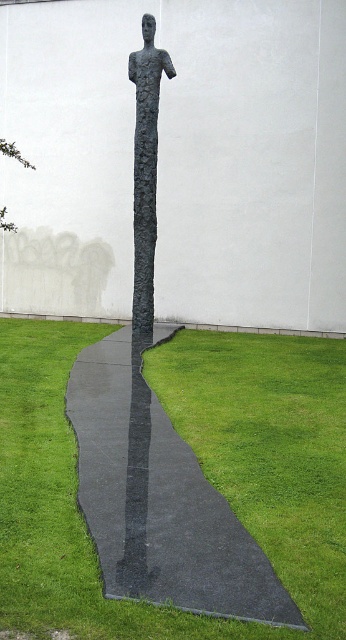
You are standing at the point marked as point (156, 497). There is a sculpture 5.23 meters away from you. If you walk straight towards the sculpture, will you be able to see the white wall behind it?

Yes, because the sculpture is only 5.23 meters away from you, so when you walk straight towards it, you will still be able to see the white wall behind it as the sculpture is not blocking the entire view.

You are standing at the center of the sculpture and looking towards the point marked at coordinates (159, 499). What material do you see at that location?

The point at coordinates (159, 499) indicates black asphalt at center, so you see black asphalt there.